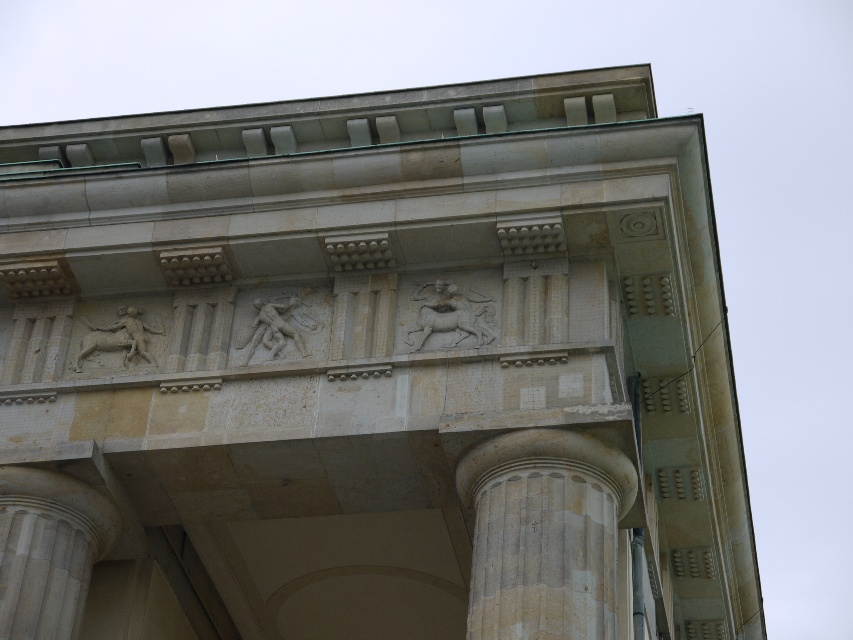
Question: Can you confirm if smooth stone column at center is positioned to the left of smooth stone column at lower left?

Choices:
 (A) yes
 (B) no

Answer: (B)

Question: Is smooth stone column at center to the left of smooth stone column at lower left from the viewer's perspective?

Choices:
 (A) yes
 (B) no

Answer: (B)

Question: Is the position of smooth stone column at center more distant than that of smooth stone column at lower left?

Choices:
 (A) yes
 (B) no

Answer: (B)

Question: Which object is farther from the camera taking this photo?

Choices:
 (A) smooth stone column at center
 (B) smooth stone column at lower left

Answer: (B)